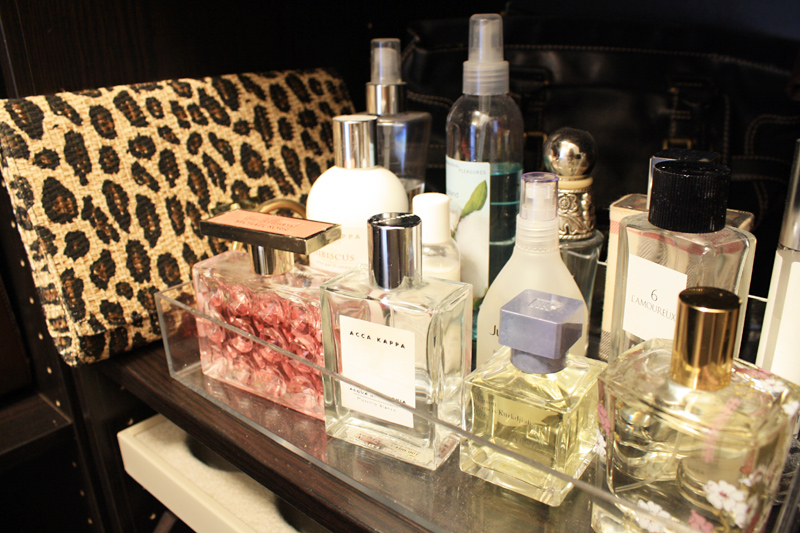
Where is `plastic container`? This screenshot has height=533, width=800. plastic container is located at coordinates (397, 486).